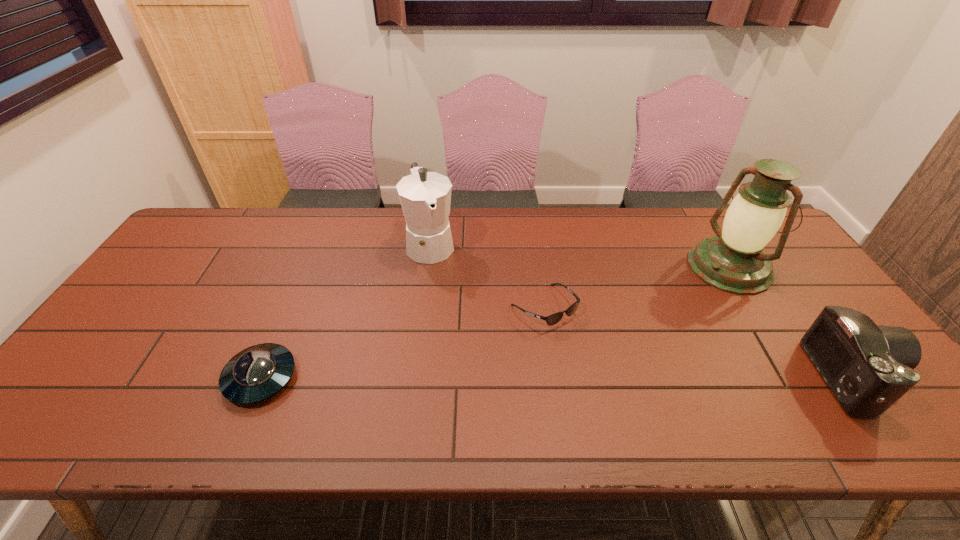
At what (x,y) coordinates should I click in order to perform the action: click on blank region between the lantern and the camera. Please return your answer as a coordinate pair (x, y). The image size is (960, 540). Looking at the image, I should click on coord(792,322).

I want to click on vacant area that lies between the sunglasses and the saucer, so click(x=402, y=342).

Where is `vacant space that's between the camera and the sunglasses`? vacant space that's between the camera and the sunglasses is located at coordinates (700, 342).

Locate an element on the screen. The width and height of the screenshot is (960, 540). vacant space that's between the third shortest object and the second tallest object is located at coordinates (643, 310).

Locate an element on the screen. The height and width of the screenshot is (540, 960). vacant area between the third object from left to right and the camera is located at coordinates (700, 342).

Locate an element on the screen. This screenshot has width=960, height=540. vacant area between the leftmost object and the camera is located at coordinates (559, 377).

Locate an element on the screen. vacant area that lies between the saucer and the camera is located at coordinates pyautogui.click(x=559, y=377).

Select which object appears as the fourth closest to the sunglasses. Please provide its 2D coordinates. Your answer should be formatted as a tuple, i.e. [(x, y)], where the tuple contains the x and y coordinates of a point satisfying the conditions above.

[(868, 367)]

The height and width of the screenshot is (540, 960). Find the location of `the fourth closest object to the coffeepot`. the fourth closest object to the coffeepot is located at coordinates (868, 367).

Image resolution: width=960 pixels, height=540 pixels. Find the location of `vacant space that satisfies the following two spatial constraints: 1. on the back side of the sunglasses; 2. on the left side of the tallest object`. vacant space that satisfies the following two spatial constraints: 1. on the back side of the sunglasses; 2. on the left side of the tallest object is located at coordinates (538, 267).